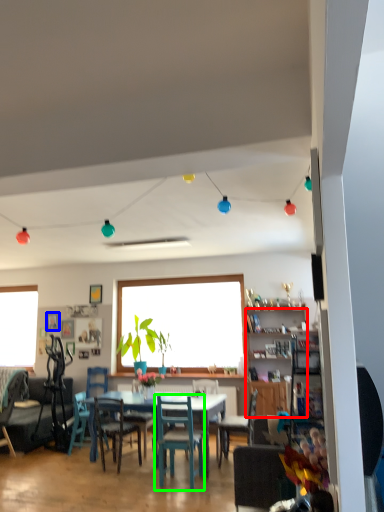
Question: Which object is the closest to the cabinetry (highlighted by a red box)? Choose among these: picture frame (highlighted by a blue box) or chair (highlighted by a green box).

Choices:
 (A) picture frame
 (B) chair

Answer: (B)